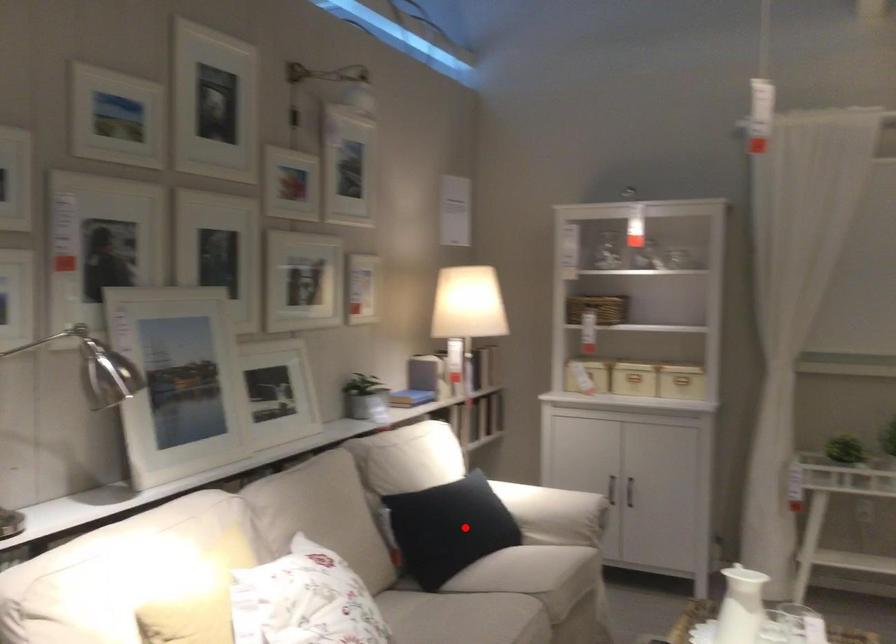
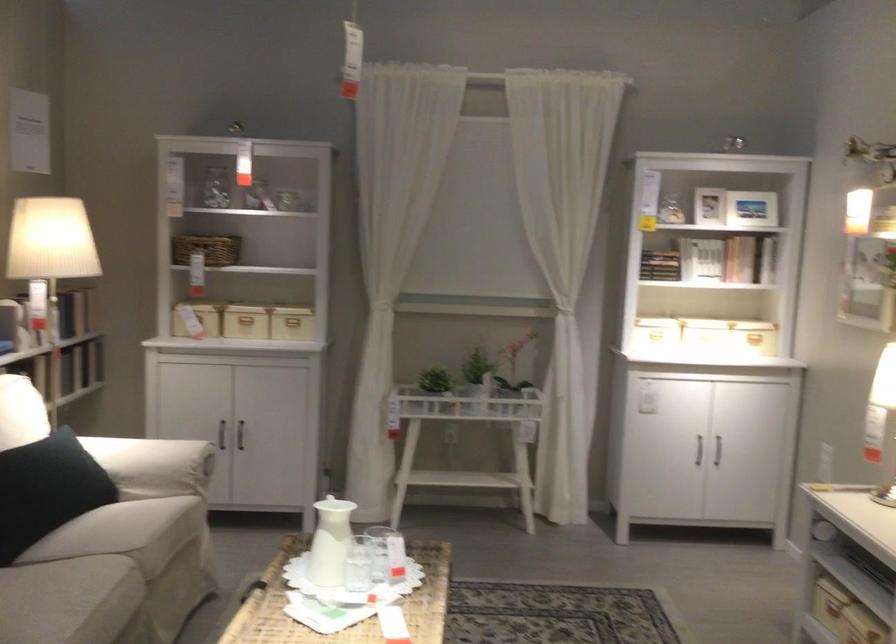
Question: I am providing you with two images of the same scene from different viewpoints. A red point is marked on the first image. At the location where the point appears in image 1, is it still visible in image 2?

Choices:
 (A) Yes
 (B) No

Answer: (A)